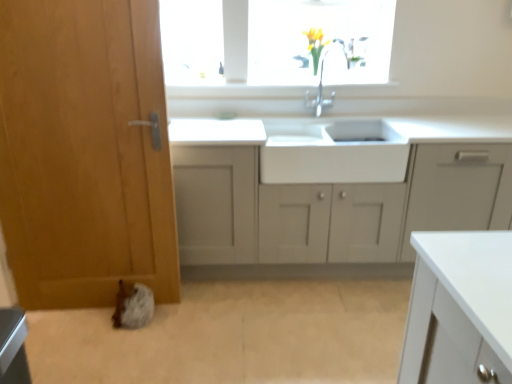
Question: Considering the relative sizes of white glossy sink at center and wooden door at left in the image provided, is white glossy sink at center thinner than wooden door at left?

Choices:
 (A) yes
 (B) no

Answer: (B)

Question: From a real-world perspective, is white glossy sink at center under wooden door at left?

Choices:
 (A) yes
 (B) no

Answer: (A)

Question: Is wooden door at left surrounded by white glossy sink at center?

Choices:
 (A) no
 (B) yes

Answer: (A)

Question: Can you see white glossy sink at center touching wooden door at left?

Choices:
 (A) no
 (B) yes

Answer: (A)

Question: Could you tell me if white glossy sink at center is turned towards wooden door at left?

Choices:
 (A) no
 (B) yes

Answer: (A)

Question: In the image, is white glossy sink at center positioned in front of or behind white matte cabinet at center?

Choices:
 (A) front
 (B) behind

Answer: (B)

Question: Is white glossy sink at center wider or thinner than white matte cabinet at center?

Choices:
 (A) thin
 (B) wide

Answer: (A)

Question: Considering the positions of white glossy sink at center and white matte cabinet at center in the image, is white glossy sink at center taller or shorter than white matte cabinet at center?

Choices:
 (A) short
 (B) tall

Answer: (A)

Question: From a real-world perspective, is white glossy sink at center physically located above or below white matte cabinet at center?

Choices:
 (A) above
 (B) below

Answer: (A)

Question: Considering the positions of white glossy sink at center and wooden door at left in the image, is white glossy sink at center wider or thinner than wooden door at left?

Choices:
 (A) wide
 (B) thin

Answer: (A)

Question: Would you say white glossy sink at center is to the left or to the right of wooden door at left in the picture?

Choices:
 (A) left
 (B) right

Answer: (B)

Question: From the image's perspective, is white glossy sink at center located above or below wooden door at left?

Choices:
 (A) below
 (B) above

Answer: (B)

Question: Would you say white glossy sink at center is inside or outside wooden door at left?

Choices:
 (A) inside
 (B) outside

Answer: (B)

Question: Is wooden door at left bigger or smaller than white glossy sink at center?

Choices:
 (A) small
 (B) big

Answer: (B)

Question: Considering the positions of wooden door at left and white glossy sink at center in the image, is wooden door at left taller or shorter than white glossy sink at center?

Choices:
 (A) short
 (B) tall

Answer: (B)